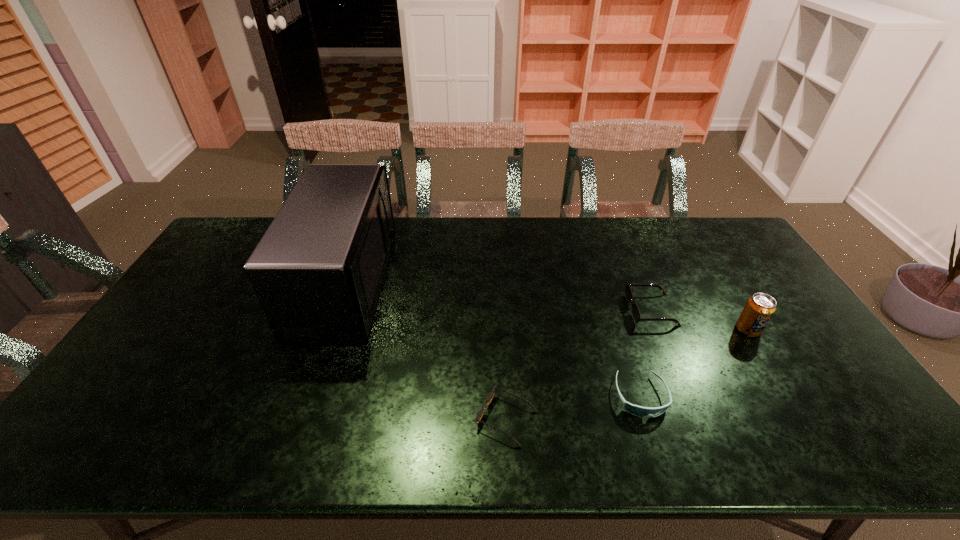
I want to click on vacant space that satisfies the following two spatial constraints: 1. on the front-facing side of the goggles; 2. on the lenses of the fourth object from right to left, so click(648, 419).

The height and width of the screenshot is (540, 960). Identify the location of free space that satisfies the following two spatial constraints: 1. on the front-facing side of the farther sunglasses; 2. on the left side of the soda can. (659, 329).

Locate an element on the screen. This screenshot has height=540, width=960. free point that satisfies the following two spatial constraints: 1. on the front-facing side of the soda can; 2. on the left side of the right sunglasses is located at coordinates (659, 329).

This screenshot has width=960, height=540. What are the coordinates of `vacant space that satisfies the following two spatial constraints: 1. on the back side of the second tallest object; 2. on the front-facing side of the leftmost object` in the screenshot? It's located at (720, 284).

Find the location of a particular element. free spot that satisfies the following two spatial constraints: 1. on the front-facing side of the taller sunglasses; 2. on the front-facing side of the goggles is located at coordinates (686, 396).